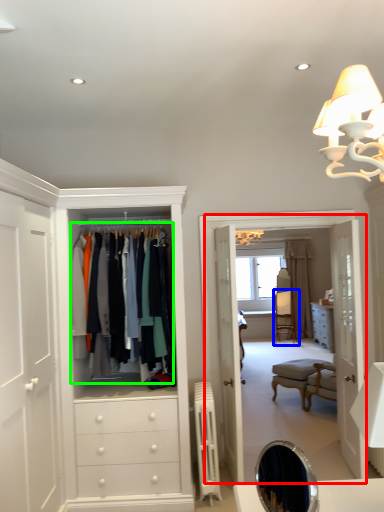
Question: Considering the real-world distances, which object is closest to boutique (highlighted by a red box)? armchair (highlighted by a blue box) or clothing (highlighted by a green box).

Choices:
 (A) armchair
 (B) clothing

Answer: (B)